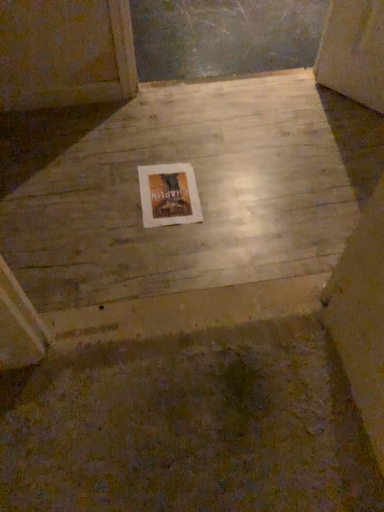
You are a GUI agent. You are given a task and a screenshot of the screen. Output one action in this format:
    pyautogui.click(x=<x>, y=<y>)
    Task: Click on the vacant area that is in front of white paper at center
    
    Given the screenshot: What is the action you would take?
    pyautogui.click(x=175, y=249)